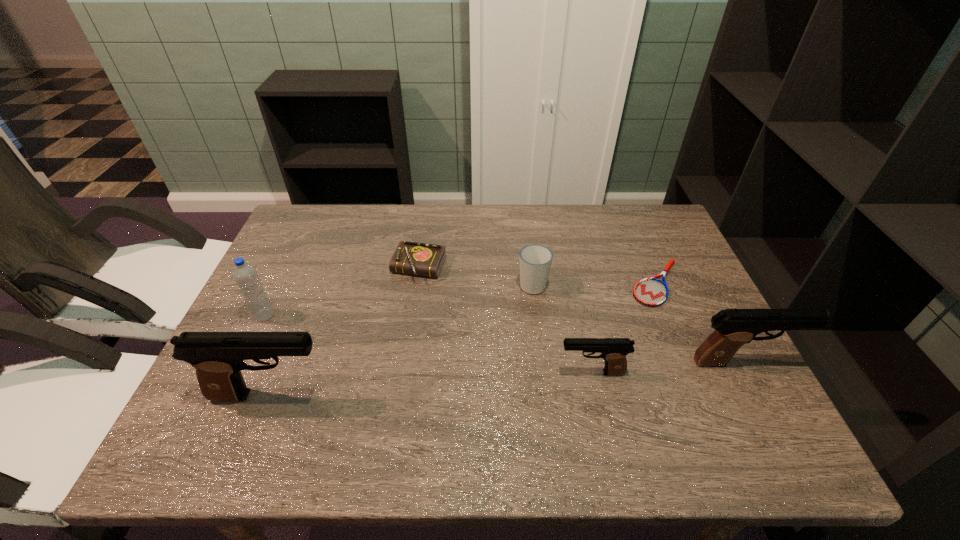
Image resolution: width=960 pixels, height=540 pixels. In the image, there is a desktop. Identify the location of free space at the far left corner. (320, 223).

Where is `vacant space at the far right corner of the desktop`? vacant space at the far right corner of the desktop is located at coordinates (626, 238).

I want to click on vacant region between the cup and the rightmost pistol, so click(x=637, y=323).

The width and height of the screenshot is (960, 540). Find the location of `free point between the tennis racket and the nearest pistol`. free point between the tennis racket and the nearest pistol is located at coordinates (463, 339).

This screenshot has width=960, height=540. I want to click on free spot between the second pistol from right to left and the tennis racket, so click(624, 328).

This screenshot has width=960, height=540. What are the coordinates of `free space between the second pistol from right to left and the second shortest pistol` in the screenshot? It's located at (667, 367).

At what (x,y) coordinates should I click in order to perform the action: click on free space that is in between the nearest object and the tennis racket. Please return your answer as a coordinate pair (x, y). The image size is (960, 540). Looking at the image, I should click on (463, 339).

This screenshot has width=960, height=540. Find the location of `empty space that is in between the cup and the shortest object`. empty space that is in between the cup and the shortest object is located at coordinates coord(594,284).

At what (x,y) coordinates should I click in order to perform the action: click on free point between the shortest object and the fourth farthest object. Please return your answer as a coordinate pair (x, y). The height and width of the screenshot is (540, 960). Looking at the image, I should click on (461, 299).

The width and height of the screenshot is (960, 540). Identify the location of free space between the water bottle and the shortest pistol. (428, 344).